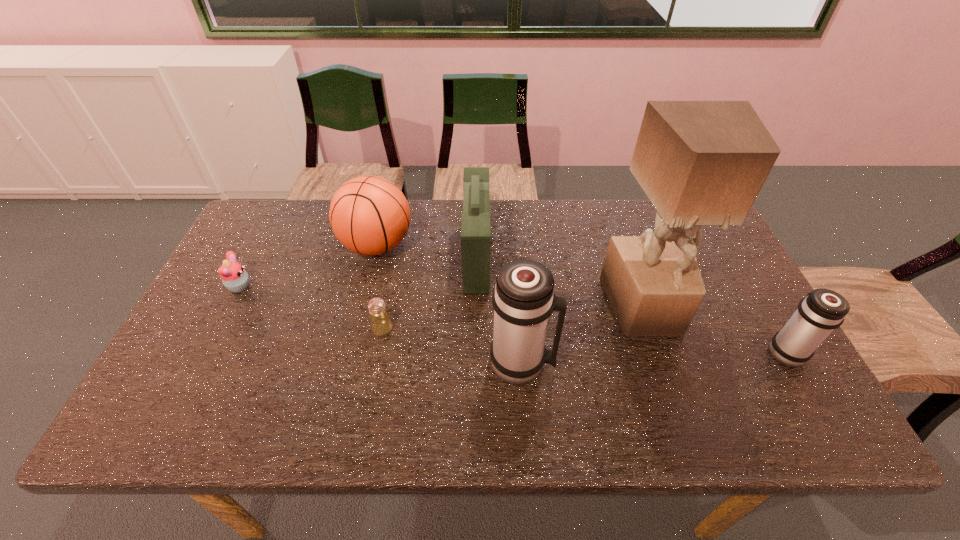
Identify the location of the first-aid kit that is at the far edge. This screenshot has width=960, height=540. (475, 221).

You are a GUI agent. You are given a task and a screenshot of the screen. Output one action in this format:
    pyautogui.click(x=<x>, y=<y>)
    Task: Click on the object that is positioned at the left edge
    The width and height of the screenshot is (960, 540).
    Given the screenshot: What is the action you would take?
    pyautogui.click(x=234, y=277)

What are the coordinates of `object that is at the right edge` in the screenshot? It's located at (821, 311).

Where is `object that is at the near right corner`? The image size is (960, 540). object that is at the near right corner is located at coordinates (821, 311).

This screenshot has height=540, width=960. What are the coordinates of `vacant region at the far edge` in the screenshot? It's located at (455, 222).

What are the coordinates of `blank space at the near edge of the desktop` in the screenshot? It's located at (492, 379).

Find the location of a particular element. The height and width of the screenshot is (540, 960). blank space at the left edge of the desktop is located at coordinates (231, 362).

The height and width of the screenshot is (540, 960). In the image, there is a desktop. Find the location of `blank space at the right edge`. blank space at the right edge is located at coordinates click(x=764, y=353).

This screenshot has width=960, height=540. Identify the location of vacant space at the far left corner of the desktop. (275, 218).

Locate an element on the screen. vacant region between the first-aid kit and the sculpture is located at coordinates (561, 282).